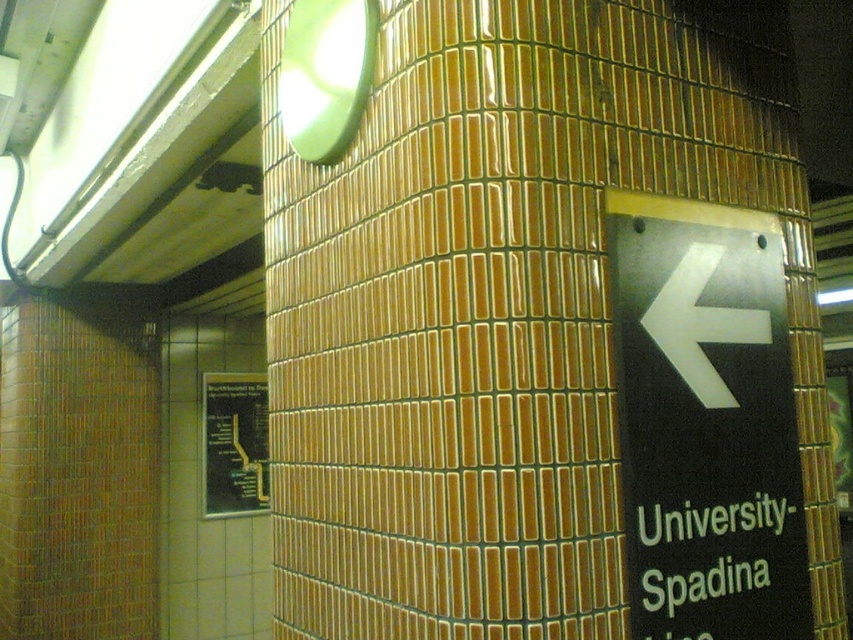
Question: Is black plastic sign at right closer to the viewer compared to green matte sign at lower right?

Choices:
 (A) no
 (B) yes

Answer: (B)

Question: Which object appears farthest from the camera in this image?

Choices:
 (A) black glossy map at lower left
 (B) green matte sign at lower right

Answer: (A)

Question: Which of the following is the farthest from the observer?

Choices:
 (A) black glossy map at lower left
 (B) green matte sign at lower right

Answer: (A)

Question: Which object is positioned farthest from the green matte sign at lower right?

Choices:
 (A) black plastic sign at right
 (B) black glossy map at lower left

Answer: (B)

Question: Is black plastic sign at right thinner than green matte sign at lower right?

Choices:
 (A) yes
 (B) no

Answer: (B)

Question: Does green matte sign at lower right appear under black glossy map at lower left?

Choices:
 (A) no
 (B) yes

Answer: (A)